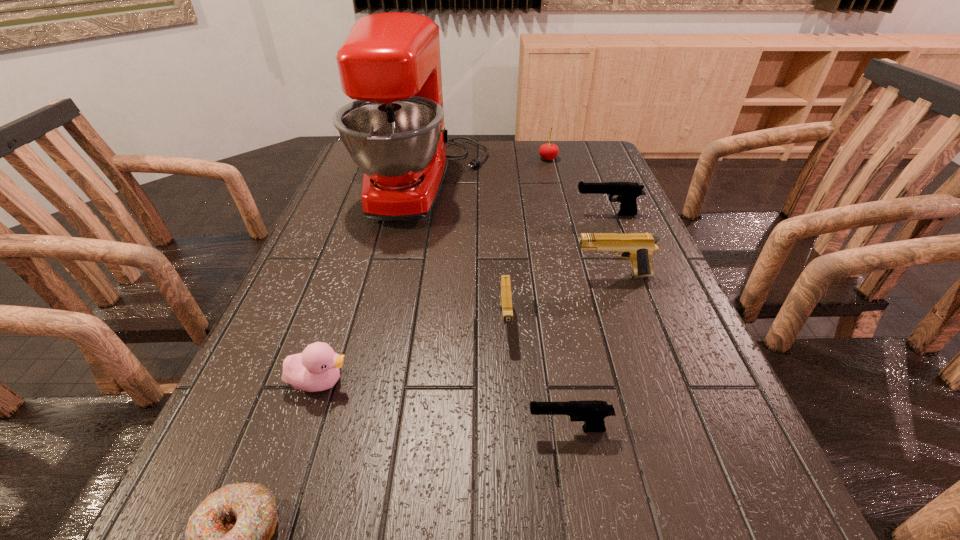
The width and height of the screenshot is (960, 540). I want to click on object situated at the far left corner, so click(390, 63).

What are the coordinates of `free region at the far edge` in the screenshot? It's located at (468, 140).

I want to click on vacant space at the near edge of the desktop, so coord(658,509).

At what (x,y) coordinates should I click in order to perform the action: click on vacant region at the left edge of the desktop. Please return your answer as a coordinate pair (x, y). This screenshot has width=960, height=540. Looking at the image, I should click on click(327, 342).

This screenshot has height=540, width=960. I want to click on vacant space at the right edge of the desktop, so click(x=682, y=490).

Locate an element on the screen. This screenshot has height=540, width=960. vacant space at the far left corner of the desktop is located at coordinates (348, 170).

At what (x,y) coordinates should I click in order to perform the action: click on vacant area at the far right corner of the desktop. Please return your answer as a coordinate pair (x, y). Looking at the image, I should click on (559, 145).

Where is `free spot between the fourth nearest object and the duckling`? Image resolution: width=960 pixels, height=540 pixels. free spot between the fourth nearest object and the duckling is located at coordinates (413, 352).

I want to click on blank region between the red cherry and the duckling, so click(x=434, y=271).

The image size is (960, 540). Find the location of `free space between the second pistol from left to right and the fourth nearest object`. free space between the second pistol from left to right and the fourth nearest object is located at coordinates (537, 375).